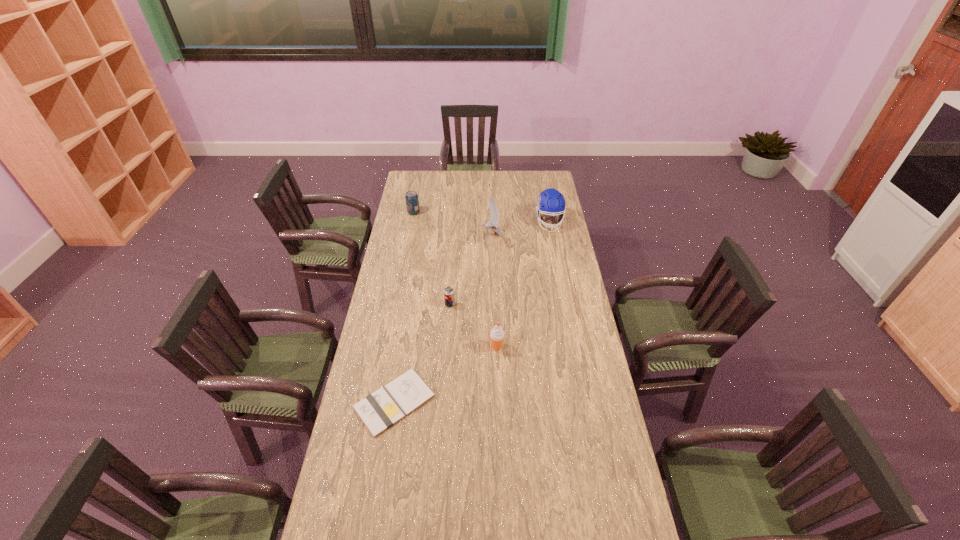
This screenshot has width=960, height=540. In order to click on vacant point located between the third shortest object and the gull in this screenshot , I will do `click(452, 224)`.

At what (x,y) coordinates should I click in order to perform the action: click on free space between the rightmost object and the gull. Please return your answer as a coordinate pair (x, y). This screenshot has width=960, height=540. Looking at the image, I should click on (520, 229).

Image resolution: width=960 pixels, height=540 pixels. Identify the location of object that ranks as the fourth closest to the fourth tallest object. (497, 335).

Image resolution: width=960 pixels, height=540 pixels. In order to click on object that ranks as the fifth closest to the football helmet in this screenshot , I will do `click(378, 411)`.

Find the location of a particular element. Image resolution: width=960 pixels, height=540 pixels. vacant region that satisfies the following two spatial constraints: 1. on the front side of the beer can; 2. on the right side of the second nearest object is located at coordinates (447, 347).

This screenshot has width=960, height=540. Find the location of `free space in the image that satisfies the following two spatial constraints: 1. at the tip of the beak of the gull; 2. on the front side of the shortest object`. free space in the image that satisfies the following two spatial constraints: 1. at the tip of the beak of the gull; 2. on the front side of the shortest object is located at coordinates (496, 402).